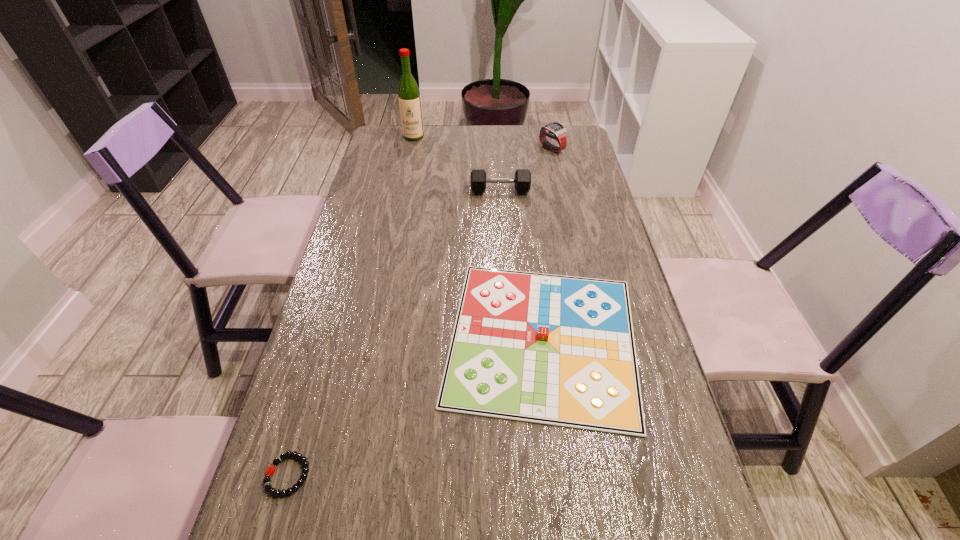
Locate an element on the screen. The height and width of the screenshot is (540, 960). vacant point located 0.120m on the right of the dumbbell is located at coordinates (565, 191).

What are the coordinates of `blank area located on the left of the fourth farthest object` in the screenshot? It's located at click(377, 339).

At what (x,y) coordinates should I click in order to perform the action: click on vacant area situated on the right of the leftmost object. Please return your answer as a coordinate pair (x, y). The image size is (960, 540). Looking at the image, I should click on (378, 475).

What are the coordinates of `liquor situated at the far edge` in the screenshot? It's located at (409, 97).

Where is `watch that is at the far edge`? Image resolution: width=960 pixels, height=540 pixels. watch that is at the far edge is located at coordinates (556, 130).

Find the location of a particular element. liquor that is at the left edge is located at coordinates [x=409, y=97].

Where is `bracelet that is at the left edge`? Image resolution: width=960 pixels, height=540 pixels. bracelet that is at the left edge is located at coordinates (271, 469).

Find the location of a particular element. watch that is positioned at the right edge is located at coordinates (556, 130).

This screenshot has height=540, width=960. I want to click on gameboard that is at the right edge, so click(x=559, y=350).

I want to click on object situated at the far left corner, so click(x=409, y=97).